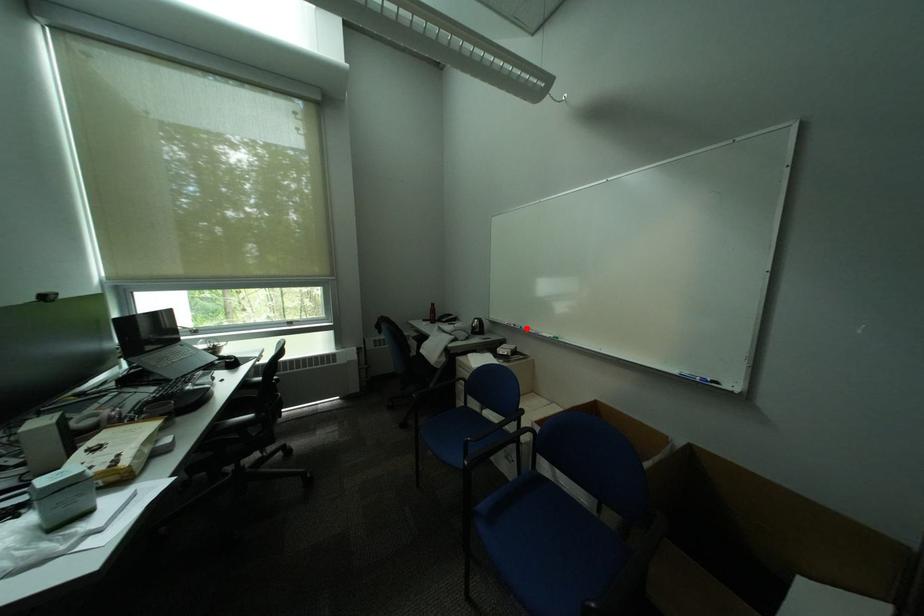
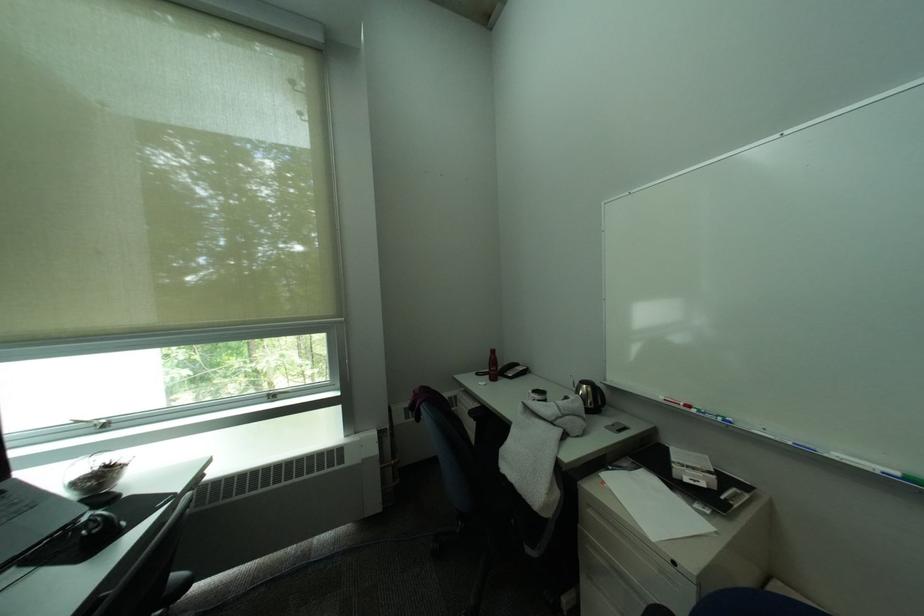
Find the pixel in the second image that matches the highlighted location in the first image.

(719, 416)